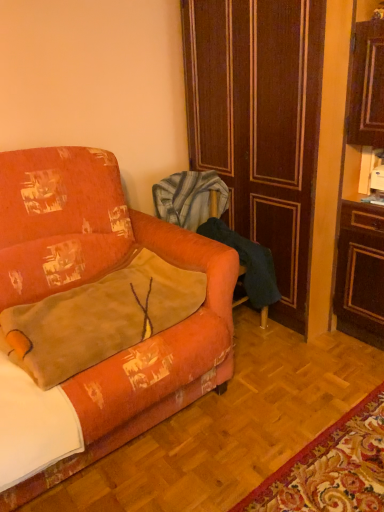
Question: Considering the relative positions of velvet orange armchair at center and velvet orange throw pillow at lower left in the image provided, is velvet orange armchair at center behind velvet orange throw pillow at lower left?

Choices:
 (A) no
 (B) yes

Answer: (B)

Question: From a real-world perspective, is velvet orange armchair at center over velvet orange throw pillow at lower left?

Choices:
 (A) no
 (B) yes

Answer: (A)

Question: Would you say velvet orange armchair at center contains velvet orange throw pillow at lower left?

Choices:
 (A) yes
 (B) no

Answer: (B)

Question: Can you confirm if velvet orange armchair at center is positioned to the left of velvet orange throw pillow at lower left?

Choices:
 (A) yes
 (B) no

Answer: (B)

Question: Considering the relative sizes of velvet orange armchair at center and velvet orange throw pillow at lower left in the image provided, is velvet orange armchair at center bigger than velvet orange throw pillow at lower left?

Choices:
 (A) yes
 (B) no

Answer: (A)

Question: Is orange fabric couch at left bigger or smaller than velvet orange armchair at center?

Choices:
 (A) small
 (B) big

Answer: (B)

Question: In terms of width, does orange fabric couch at left look wider or thinner when compared to velvet orange armchair at center?

Choices:
 (A) thin
 (B) wide

Answer: (B)

Question: From the image's perspective, relative to velvet orange armchair at center, is orange fabric couch at left above or below?

Choices:
 (A) above
 (B) below

Answer: (B)

Question: Considering the positions of orange fabric couch at left and velvet orange armchair at center in the image, is orange fabric couch at left taller or shorter than velvet orange armchair at center?

Choices:
 (A) short
 (B) tall

Answer: (B)

Question: Is brown wood door at center to the left or to the right of orange fabric couch at left in the image?

Choices:
 (A) left
 (B) right

Answer: (B)

Question: In terms of width, does brown wood door at center look wider or thinner when compared to orange fabric couch at left?

Choices:
 (A) wide
 (B) thin

Answer: (B)

Question: Is brown wood door at center taller or shorter than orange fabric couch at left?

Choices:
 (A) short
 (B) tall

Answer: (B)

Question: Is brown wood door at center bigger or smaller than orange fabric couch at left?

Choices:
 (A) small
 (B) big

Answer: (A)

Question: Visually, is orange fabric couch at left positioned to the left or to the right of velvet orange throw pillow at lower left?

Choices:
 (A) left
 (B) right

Answer: (A)

Question: In terms of size, does orange fabric couch at left appear bigger or smaller than velvet orange throw pillow at lower left?

Choices:
 (A) small
 (B) big

Answer: (B)